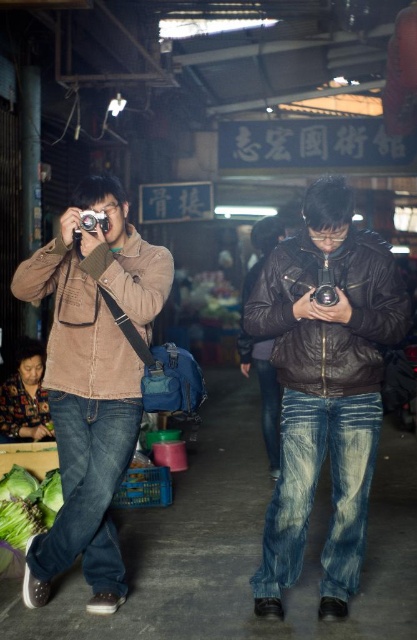
Does matte black jacket at center have a greater height compared to matte brown jacket at left?

No.

Does point (372, 273) lie behind point (130, 451)?

No.

In order to click on matte black jacket at center in this screenshot , I will do `click(324, 388)`.

Who is positioned more to the right, matte brown jacket at left or green leafy vegetable at lower left?

matte brown jacket at left

Does matte brown jacket at left have a lesser width compared to green leafy vegetable at lower left?

No.

Does point (100, 595) lie in front of point (0, 536)?

Yes, it is in front of point (0, 536).

You are a GUI agent. You are given a task and a screenshot of the screen. Output one action in this format:
    pyautogui.click(x=<x>, y=<y>)
    Task: Click on the matte brown jacket at left
    This screenshot has width=417, height=640.
    Given the screenshot: What is the action you would take?
    pyautogui.click(x=92, y=384)

Between matte black jacket at center and green leafy vegetable at lower left, which one appears on the left side from the viewer's perspective?

green leafy vegetable at lower left is more to the left.

Looking at this image, is matte black jacket at center above green leafy vegetable at lower left?

Yes, matte black jacket at center is above green leafy vegetable at lower left.

Between point (293, 349) and point (7, 560), which one is positioned behind?

The point (7, 560) is more distant.

I want to click on matte black jacket at center, so click(324, 388).